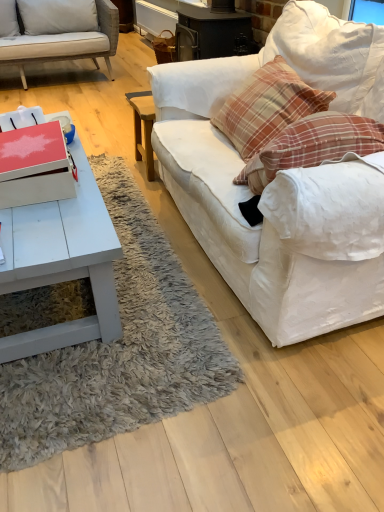
Question: Can you confirm if white fabric couch at right is wider than white matte coffee table at lower left?

Choices:
 (A) no
 (B) yes

Answer: (A)

Question: Does white fabric couch at right have a smaller size compared to white matte coffee table at lower left?

Choices:
 (A) yes
 (B) no

Answer: (B)

Question: Is white fabric couch at right facing towards white matte coffee table at lower left?

Choices:
 (A) no
 (B) yes

Answer: (B)

Question: From a real-world perspective, is white fabric couch at right physically below white matte coffee table at lower left?

Choices:
 (A) yes
 (B) no

Answer: (B)

Question: From the image's perspective, does white fabric couch at right appear higher than white matte coffee table at lower left?

Choices:
 (A) no
 (B) yes

Answer: (B)

Question: In terms of size, does white matte coffee table at lower left appear bigger or smaller than white fabric couch at right?

Choices:
 (A) big
 (B) small

Answer: (B)

Question: From the image's perspective, is white matte coffee table at lower left above or below white fabric couch at right?

Choices:
 (A) above
 (B) below

Answer: (B)

Question: Would you say white matte coffee table at lower left is inside or outside white fabric couch at right?

Choices:
 (A) outside
 (B) inside

Answer: (A)

Question: From a real-world perspective, is white matte coffee table at lower left above or below white fabric couch at right?

Choices:
 (A) above
 (B) below

Answer: (B)

Question: From their relative heights in the image, would you say plaid fabric pillow at upper right is taller or shorter than white matte coffee table at lower left?

Choices:
 (A) tall
 (B) short

Answer: (B)

Question: Does point (284, 68) appear closer or farther from the camera than point (79, 155)?

Choices:
 (A) closer
 (B) farther

Answer: (B)

Question: Considering the relative positions of plaid fabric pillow at upper right and white matte coffee table at lower left in the image provided, is plaid fabric pillow at upper right to the left or to the right of white matte coffee table at lower left?

Choices:
 (A) left
 (B) right

Answer: (B)

Question: Considering their positions, is plaid fabric pillow at upper right located in front of or behind white matte coffee table at lower left?

Choices:
 (A) behind
 (B) front

Answer: (A)

Question: Is white fabric couch at right inside or outside of white matte coffee table at lower left?

Choices:
 (A) outside
 (B) inside

Answer: (A)

Question: Is point (271, 234) closer or farther from the camera than point (54, 227)?

Choices:
 (A) farther
 (B) closer

Answer: (B)